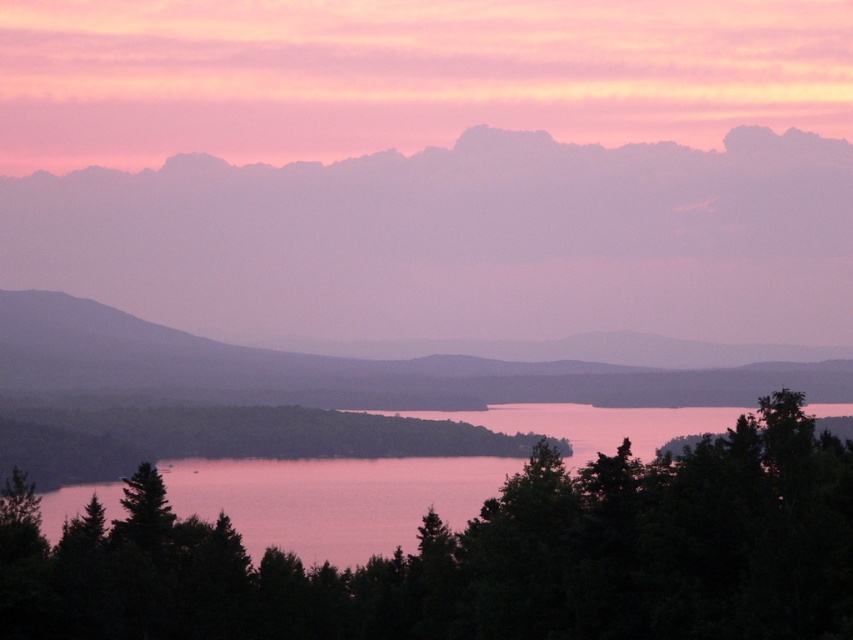
Does purple foggy cloud at upper center have a smaller size compared to smooth purple mountain at left?

Correct, purple foggy cloud at upper center occupies less space than smooth purple mountain at left.

Looking at this image, how distant is purple foggy cloud at upper center from smooth purple mountain at left?

purple foggy cloud at upper center and smooth purple mountain at left are 32.80 meters apart.

Who is more forward, (119, 228) or (15, 342)?

Point (15, 342) is in front.

Image resolution: width=853 pixels, height=640 pixels. I want to click on purple foggy cloud at upper center, so click(x=459, y=244).

Can you confirm if green matte tree at center is bigger than smooth purple mountain at left?

No, green matte tree at center is not bigger than smooth purple mountain at left.

Is green matte tree at center in front of smooth purple mountain at left?

Yes, it is in front of smooth purple mountain at left.

What do you see at coordinates (483, 556) in the screenshot? I see `green matte tree at center` at bounding box center [483, 556].

Image resolution: width=853 pixels, height=640 pixels. In order to click on green matte tree at center in this screenshot , I will do `click(483, 556)`.

Who is shorter, pink matte cloud at upper center or green matte tree at center?

With less height is green matte tree at center.

Is pink matte cloud at upper center below green matte tree at center?

No, pink matte cloud at upper center is not below green matte tree at center.

This screenshot has width=853, height=640. What do you see at coordinates (404, 74) in the screenshot?
I see `pink matte cloud at upper center` at bounding box center [404, 74].

Locate an element on the screen. The image size is (853, 640). pink matte cloud at upper center is located at coordinates (404, 74).